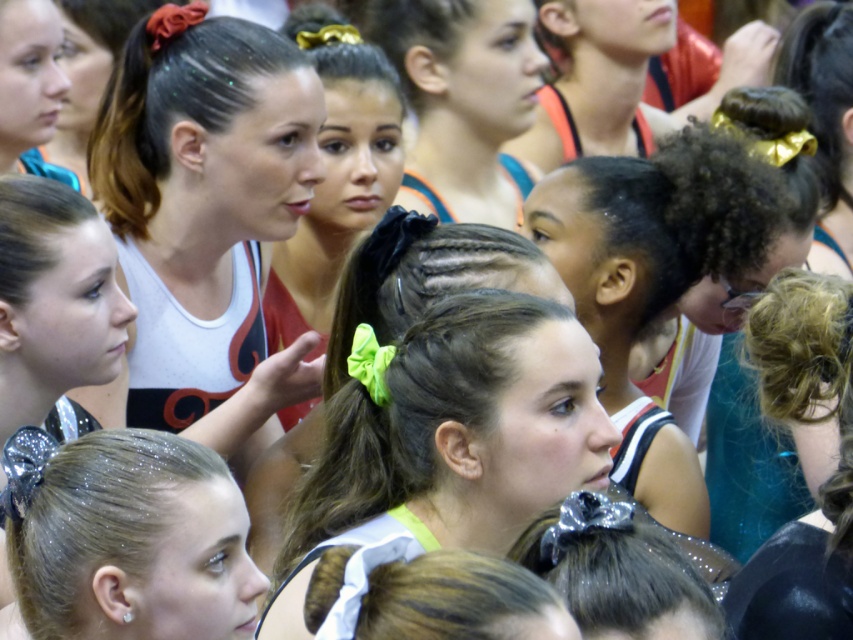
Who is taller, matte black hair at center or shiny silver bow at center?

Standing taller between the two is matte black hair at center.

Does matte black hair at center have a greater width compared to shiny silver bow at center?

Indeed, matte black hair at center has a greater width compared to shiny silver bow at center.

Between point (519, 193) and point (622, 625), which one is positioned behind?

The point (519, 193) is behind.

This screenshot has width=853, height=640. In order to click on matte black hair at center in this screenshot , I will do `click(463, 100)`.

Does shiny dark brown hair at center come behind shiny silver bow at center?

Yes, it is.

The width and height of the screenshot is (853, 640). What do you see at coordinates (171, 106) in the screenshot?
I see `shiny dark brown hair at center` at bounding box center [171, 106].

You are a GUI agent. You are given a task and a screenshot of the screen. Output one action in this format:
    pyautogui.click(x=<x>, y=<y>)
    Task: Click on the shiny dark brown hair at center
    
    Given the screenshot: What is the action you would take?
    pyautogui.click(x=171, y=106)

Which is more to the right, matte white tank top at center or sparkly silver hair clip at lower left?

From the viewer's perspective, sparkly silver hair clip at lower left appears more on the right side.

Consider the image. Can you confirm if matte white tank top at center is positioned to the left of sparkly silver hair clip at lower left?

Indeed, matte white tank top at center is positioned on the left side of sparkly silver hair clip at lower left.

Is point (135, 236) in front of point (30, 449)?

No, (135, 236) is further to viewer.

The image size is (853, 640). Find the location of `matte white tank top at center`. matte white tank top at center is located at coordinates pyautogui.click(x=206, y=216).